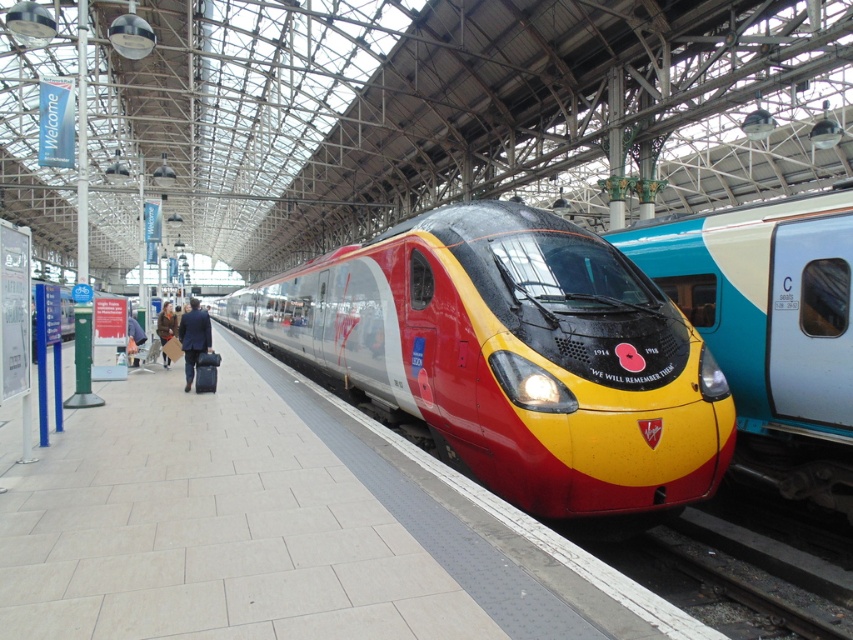
Question: Which object is closer to the camera taking this photo?

Choices:
 (A) leather jacket at center
 (B) smooth concrete platform at center
 (C) matte yellow train at center

Answer: (B)

Question: Can you confirm if smooth concrete platform at center is bigger than dark blue suit at center?

Choices:
 (A) yes
 (B) no

Answer: (A)

Question: Is matte yellow train at center wider than leather jacket at center?

Choices:
 (A) yes
 (B) no

Answer: (B)

Question: Which point is farther from the camera taking this photo?

Choices:
 (A) (268, 321)
 (B) (471, 493)

Answer: (A)

Question: Which object is positioned closest to the smooth concrete platform at center?

Choices:
 (A) metallic silver train at center
 (B) leather jacket at center
 (C) dark blue suit at center
 (D) matte yellow train at center

Answer: (A)

Question: Can you confirm if smooth concrete platform at center is smaller than leather jacket at center?

Choices:
 (A) no
 (B) yes

Answer: (B)